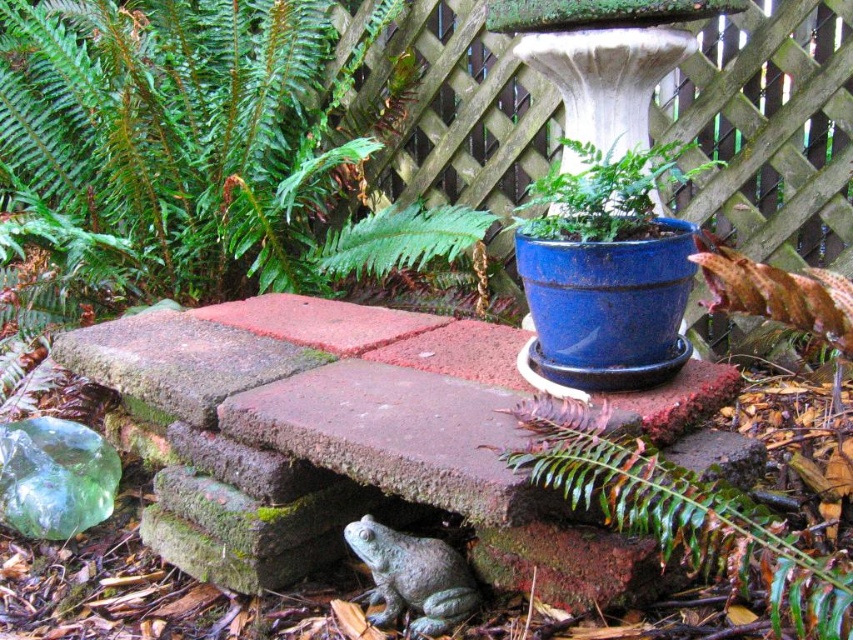
Is green leafy fern at lower center wider than blue ceramic pot at upper center?

No.

Is green leafy fern at lower center taller than blue ceramic pot at upper center?

In fact, green leafy fern at lower center may be shorter than blue ceramic pot at upper center.

Who is more forward, (544, 442) or (676, 163)?

Point (544, 442)

Locate an element on the screen. green leafy fern at lower center is located at coordinates (683, 515).